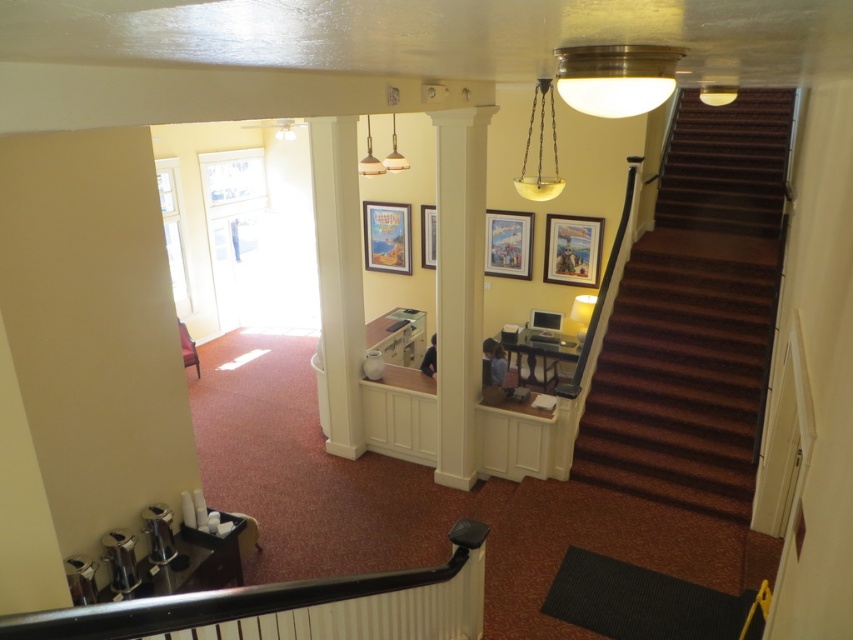
Is brown carpeted stairs at right below white glossy column at center?

Indeed, brown carpeted stairs at right is positioned under white glossy column at center.

Is brown carpeted stairs at right taller than white glossy column at center?

Incorrect, brown carpeted stairs at right's height is not larger of white glossy column at center's.

Between point (709, 196) and point (334, 131), which one is positioned behind?

Positioned behind is point (709, 196).

Find the location of `brown carpeted stairs at right`. brown carpeted stairs at right is located at coordinates (695, 316).

Which of these two, white smooth column at center or wooden picture frame at upper center, stands shorter?

Standing shorter between the two is wooden picture frame at upper center.

Which is behind, point (444, 305) or point (544, 266)?

Positioned behind is point (544, 266).

Between point (451, 321) and point (595, 282), which one is positioned in front?

Point (451, 321) is in front.

Identify the location of white smooth column at center. The height and width of the screenshot is (640, 853). (459, 285).

Measure the distance between white smooth column at center and matte plastic picture frame at center.

A distance of 13.17 feet exists between white smooth column at center and matte plastic picture frame at center.

Between point (468, 209) and point (403, 211), which one is positioned in front?

Point (468, 209) is in front.

Identify the location of white smooth column at center. (459, 285).